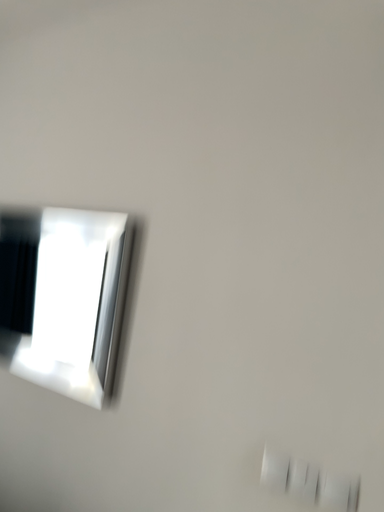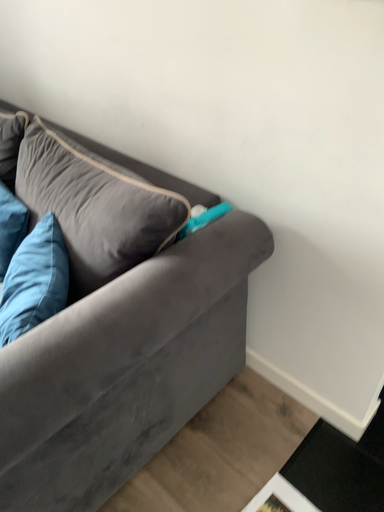
Question: Which way did the camera rotate in the video?

Choices:
 (A) rotated right
 (B) rotated left

Answer: (B)